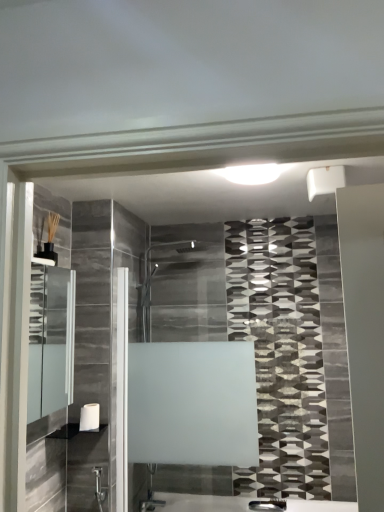
Question: Is clear glass medicine cabinet at left oriented away from white glossy shelf at lower left?

Choices:
 (A) no
 (B) yes

Answer: (A)

Question: From a real-world perspective, is clear glass medicine cabinet at left physically below white glossy shelf at lower left?

Choices:
 (A) no
 (B) yes

Answer: (A)

Question: Is clear glass medicine cabinet at left bigger than white glossy shelf at lower left?

Choices:
 (A) yes
 (B) no

Answer: (A)

Question: Is clear glass medicine cabinet at left oriented towards white glossy shelf at lower left?

Choices:
 (A) no
 (B) yes

Answer: (A)

Question: Is clear glass medicine cabinet at left thinner than white glossy shelf at lower left?

Choices:
 (A) no
 (B) yes

Answer: (B)

Question: From a real-world perspective, is clear glass medicine cabinet at left physically located above or below white glossy shelf at lower left?

Choices:
 (A) above
 (B) below

Answer: (A)

Question: Considering the positions of clear glass medicine cabinet at left and white glossy shelf at lower left in the image, is clear glass medicine cabinet at left wider or thinner than white glossy shelf at lower left?

Choices:
 (A) thin
 (B) wide

Answer: (A)

Question: Considering the positions of clear glass medicine cabinet at left and white glossy shelf at lower left in the image, is clear glass medicine cabinet at left bigger or smaller than white glossy shelf at lower left?

Choices:
 (A) big
 (B) small

Answer: (A)

Question: From the image's perspective, is clear glass medicine cabinet at left positioned above or below white glossy shelf at lower left?

Choices:
 (A) below
 (B) above

Answer: (B)

Question: Based on their sizes in the image, would you say clear glass medicine cabinet at left is bigger or smaller than white matte towel bar at lower left?

Choices:
 (A) big
 (B) small

Answer: (A)

Question: Considering the positions of clear glass medicine cabinet at left and white matte towel bar at lower left in the image, is clear glass medicine cabinet at left wider or thinner than white matte towel bar at lower left?

Choices:
 (A) wide
 (B) thin

Answer: (A)

Question: Choose the correct answer: Is clear glass medicine cabinet at left inside white matte towel bar at lower left or outside it?

Choices:
 (A) outside
 (B) inside

Answer: (A)

Question: In the image, is clear glass medicine cabinet at left on the left side or the right side of white matte towel bar at lower left?

Choices:
 (A) right
 (B) left

Answer: (B)

Question: Is point (99, 425) closer or farther from the camera than point (51, 361)?

Choices:
 (A) closer
 (B) farther

Answer: (B)

Question: Is white glossy shelf at lower left spatially inside clear glass medicine cabinet at left, or outside of it?

Choices:
 (A) outside
 (B) inside

Answer: (A)